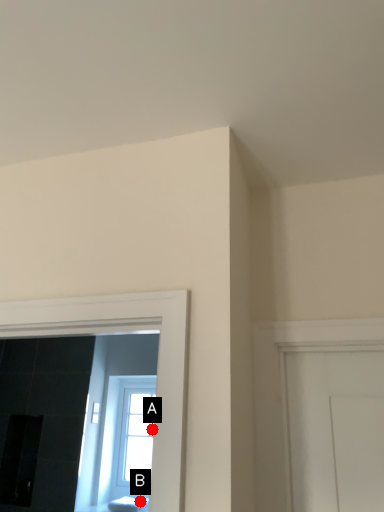
Question: Two points are circled on the image, labeled by A and B beside each circle. Which point is closer to the camera?

Choices:
 (A) A is closer
 (B) B is closer

Answer: (A)